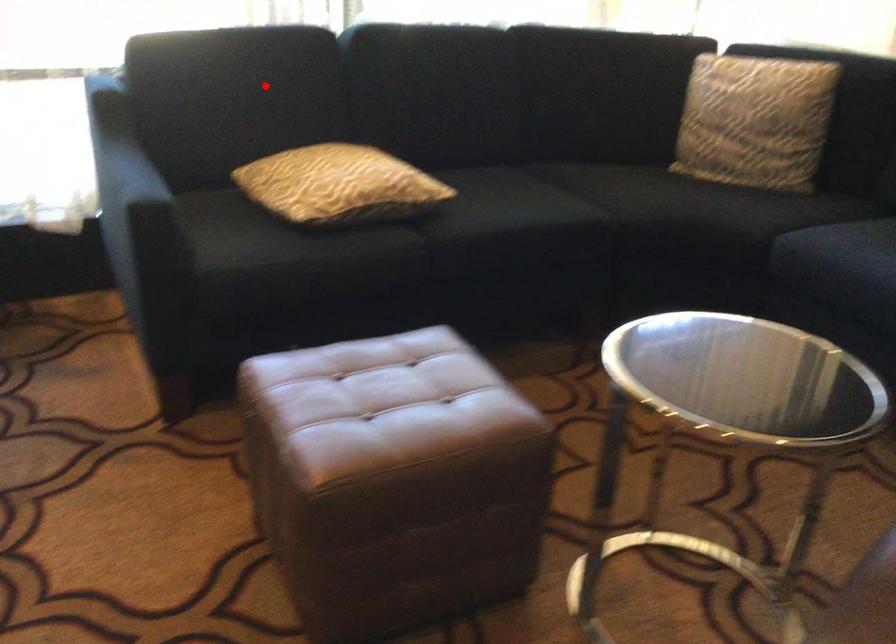
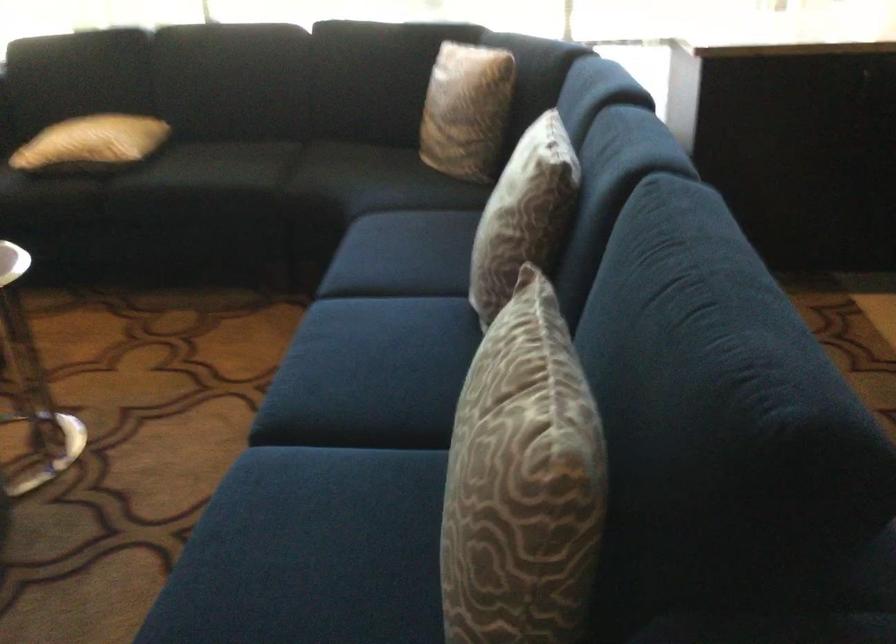
Question: I am providing you with two images of the same scene from different viewpoints. A red point is shown in image1. For the corresponding object point in image2, is it positioned nearer or farther from the camera?

Choices:
 (A) Nearer
 (B) Farther

Answer: (B)